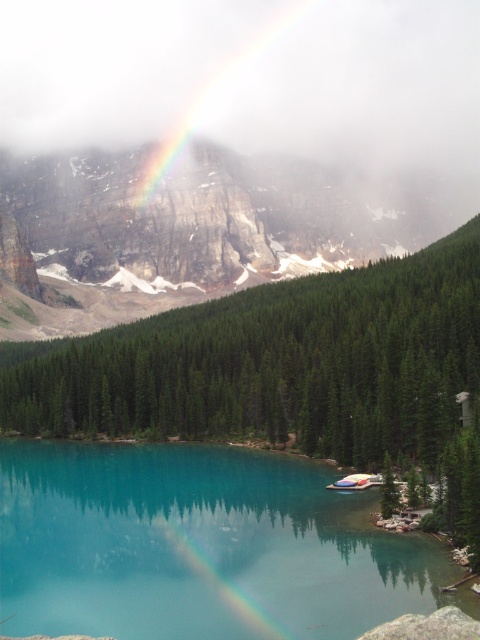
Question: Is the position of turquoise glassy lake at lower center less distant than that of rainbow at center?

Choices:
 (A) no
 (B) yes

Answer: (B)

Question: Among these objects, which one is farthest from the camera?

Choices:
 (A) turquoise glassy lake at lower center
 (B) rainbow at center

Answer: (B)

Question: Among these objects, which one is farthest from the camera?

Choices:
 (A) green matte tree at center
 (B) turquoise glassy lake at lower center
 (C) rainbow at center

Answer: (A)

Question: Is green matte tree at center above turquoise glassy lake at lower center?

Choices:
 (A) no
 (B) yes

Answer: (B)

Question: Is green matte tree at center positioned behind rainbow at center?

Choices:
 (A) yes
 (B) no

Answer: (A)

Question: Among these objects, which one is farthest from the camera?

Choices:
 (A) rainbow at center
 (B) turquoise glassy lake at lower center

Answer: (A)